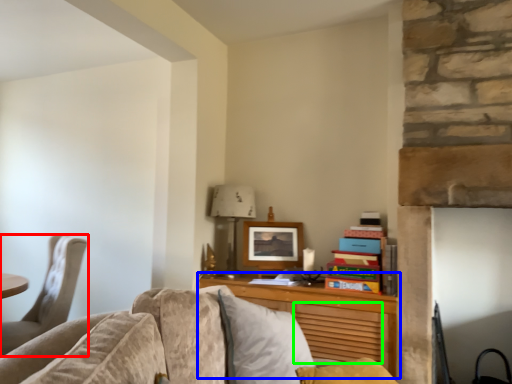
Question: Which object is the closest to the chair (highlighted by a red box)? Choose among these: desk (highlighted by a blue box) or drawer (highlighted by a green box).

Choices:
 (A) desk
 (B) drawer

Answer: (A)